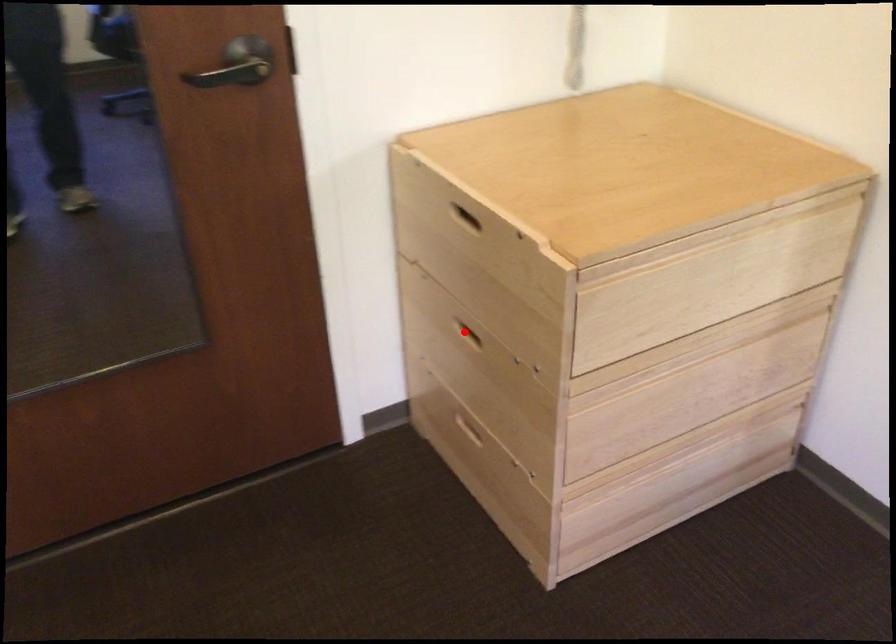
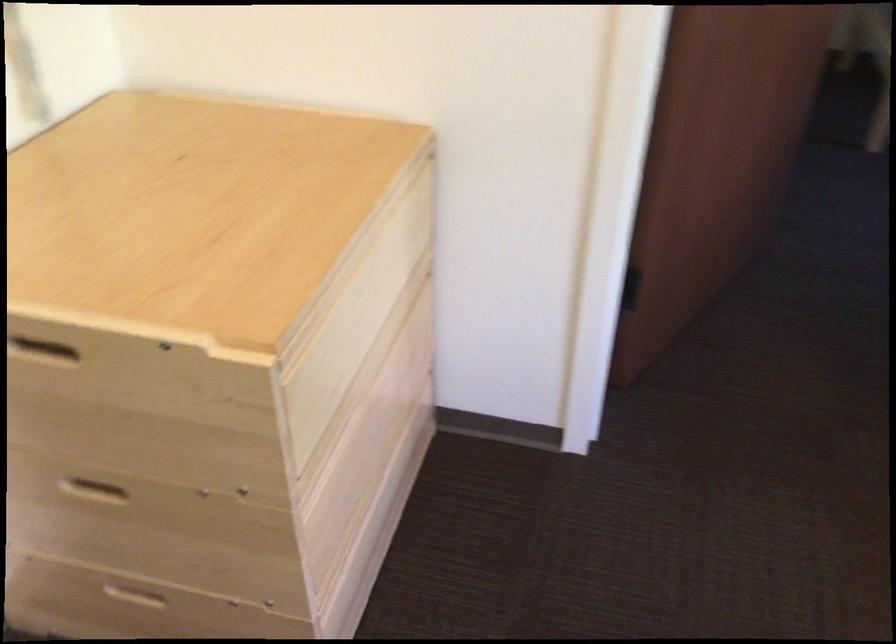
Locate, in the second image, the point that corresponds to the highlighted location in the first image.

(90, 488)